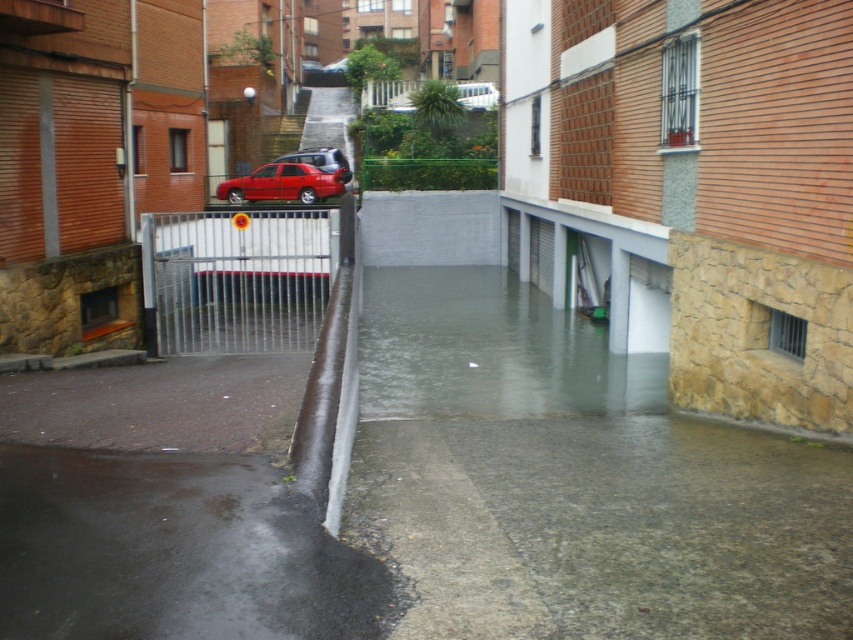
Question: Is clear water at lower center behind metallic red car at center?

Choices:
 (A) no
 (B) yes

Answer: (A)

Question: Can you confirm if glossy asphalt puddle at lower left is positioned to the right of metallic red car at center?

Choices:
 (A) yes
 (B) no

Answer: (A)

Question: Which is nearer to the glossy asphalt puddle at lower left?

Choices:
 (A) clear water at lower center
 (B) shiny red car at center

Answer: (A)

Question: Can you confirm if glossy asphalt puddle at lower left is positioned above shiny red car at center?

Choices:
 (A) no
 (B) yes

Answer: (A)

Question: Considering the real-world distances, which object is closest to the glossy asphalt puddle at lower left?

Choices:
 (A) metallic red car at center
 (B) clear water at lower center

Answer: (B)

Question: Which point is closer to the camera taking this photo?

Choices:
 (A) (343, 180)
 (B) (585, 326)
 (C) (329, 164)

Answer: (B)